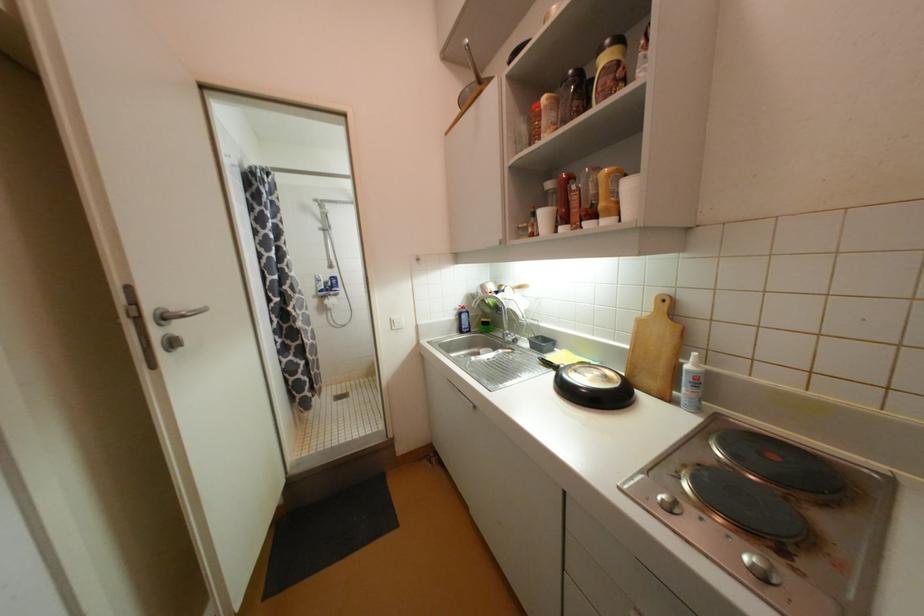
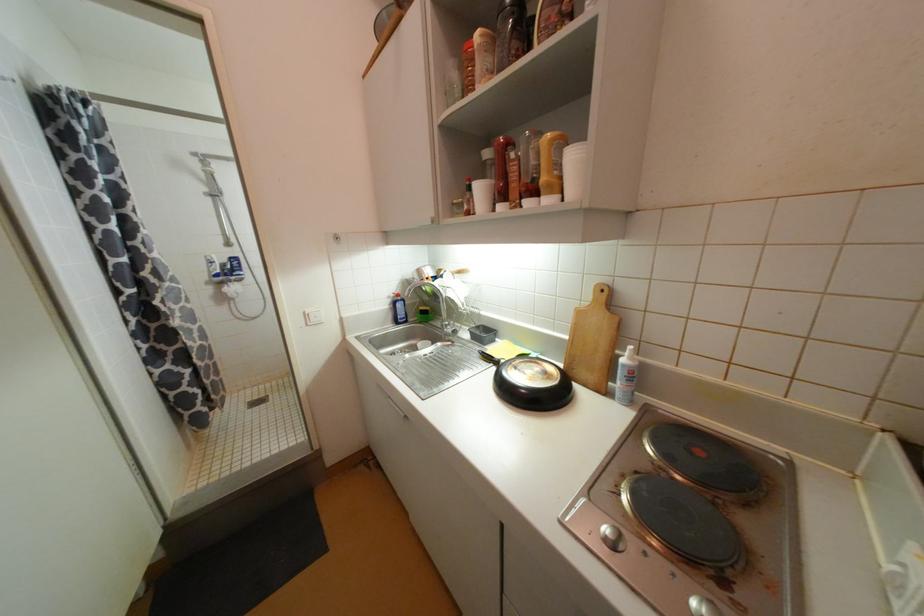
Question: The camera is either moving clockwise (left) or counter-clockwise (right) around the object. The first image is from the beginning of the video and the second image is from the end. Is the camera moving left or right when shooting the video?

Choices:
 (A) Left
 (B) Right

Answer: (A)